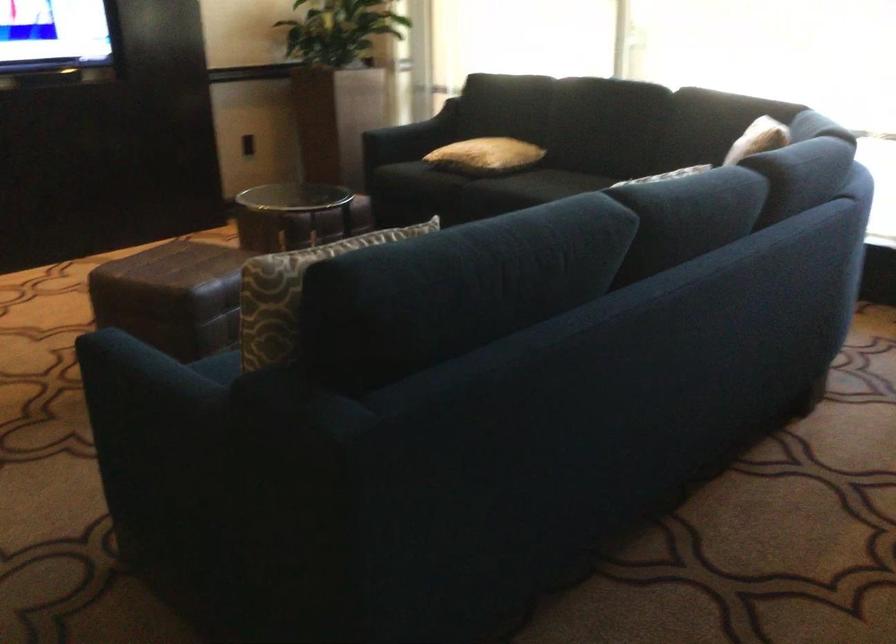
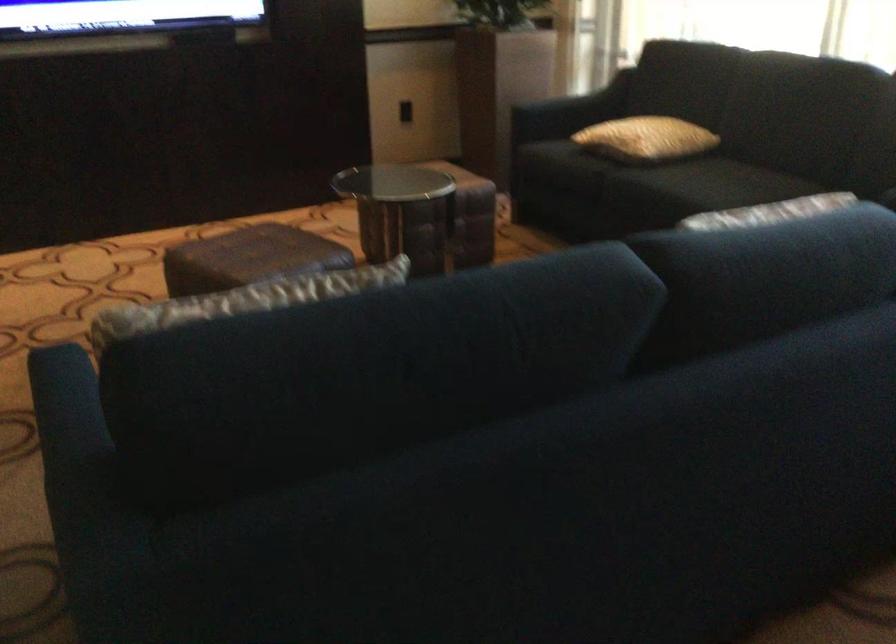
In the second image, find the point that corresponds to point 167,374 in the first image.

(69, 431)